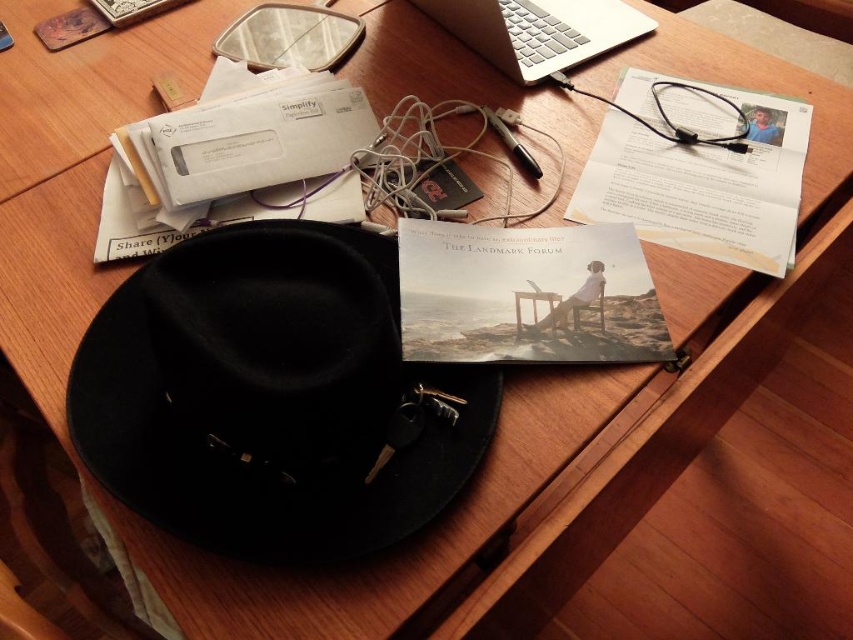
Is white paper at upper right further to camera compared to silver metallic laptop at upper center?

No, it is in front of silver metallic laptop at upper center.

Is white paper at upper right smaller than silver metallic laptop at upper center?

Actually, white paper at upper right might be larger than silver metallic laptop at upper center.

Where is `white paper at upper right`? white paper at upper right is located at coordinates (698, 170).

Is black felt fedora at lower left positioned behind silver metallic laptop at upper center?

That is False.

Image resolution: width=853 pixels, height=640 pixels. What do you see at coordinates (273, 396) in the screenshot? I see `black felt fedora at lower left` at bounding box center [273, 396].

Where is `black felt fedora at lower left`? The width and height of the screenshot is (853, 640). black felt fedora at lower left is located at coordinates (273, 396).

Can you confirm if black felt fedora at lower left is bigger than white paper at upper right?

Yes, black felt fedora at lower left is bigger than white paper at upper right.

Is point (457, 429) positioned in front of point (645, 145)?

Yes, point (457, 429) is in front of point (645, 145).

What do you see at coordinates (273, 396) in the screenshot?
I see `black felt fedora at lower left` at bounding box center [273, 396].

The image size is (853, 640). Find the location of `black felt fedora at lower left`. black felt fedora at lower left is located at coordinates (273, 396).